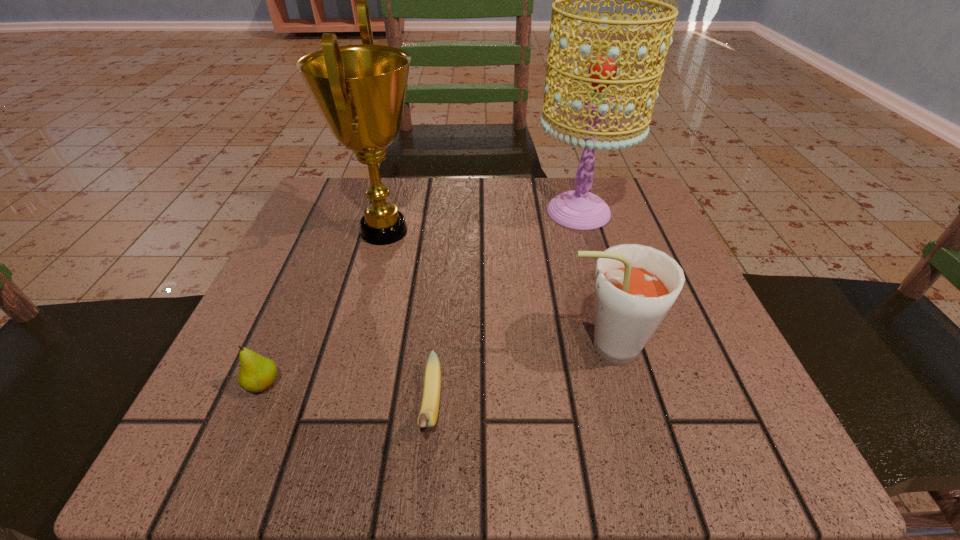
In order to click on blank space that satisfies the following two spatial constraints: 1. on the drink side of the root beer; 2. on the front side of the leftmost object in this screenshot , I will do `click(614, 384)`.